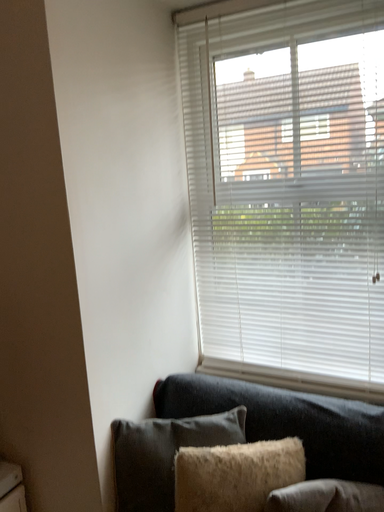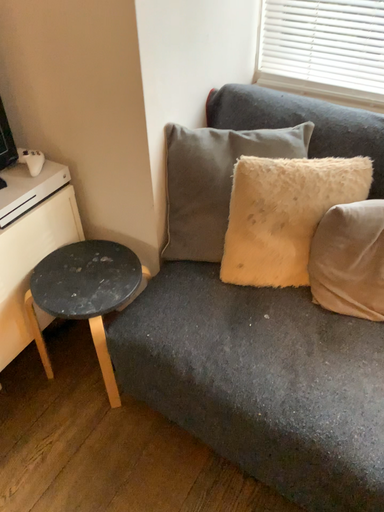
Question: How did the camera likely rotate when shooting the video?

Choices:
 (A) rotated downward
 (B) rotated upward

Answer: (A)